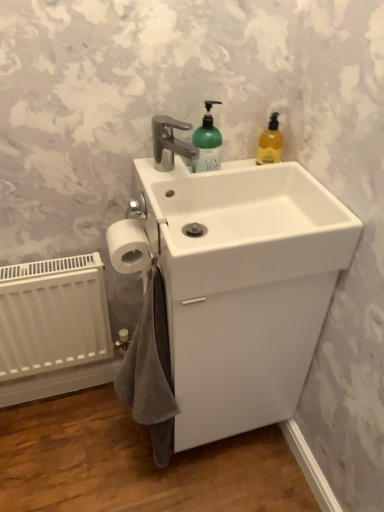
Question: In terms of height, does gray cotton bath towel at lower left look taller or shorter compared to white matte toilet paper at lower left?

Choices:
 (A) short
 (B) tall

Answer: (B)

Question: Is gray cotton bath towel at lower left bigger or smaller than white matte toilet paper at lower left?

Choices:
 (A) small
 (B) big

Answer: (B)

Question: Based on their relative distances, which object is farther from the white matte toilet paper at lower left?

Choices:
 (A) white glossy sink at center
 (B) white glossy sink at center
 (C) translucent amber liquid soap at upper right
 (D) gray cotton bath towel at lower left
 (E) white matte radiator at lower left

Answer: (C)

Question: Estimate the real-world distances between objects in this image. Which object is farther from the white matte toilet paper at lower left?

Choices:
 (A) gray cotton bath towel at lower left
 (B) translucent amber liquid soap at upper right
 (C) white glossy sink at center
 (D) white glossy sink at center
 (E) white matte radiator at lower left

Answer: (B)